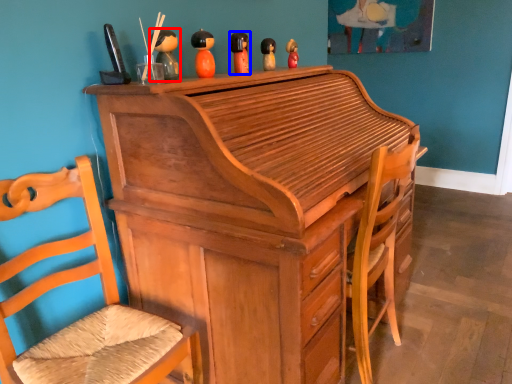
Question: Which object appears farthest to the camera in this image, toy (highlighted by a red box) or toy (highlighted by a blue box)?

Choices:
 (A) toy
 (B) toy

Answer: (B)